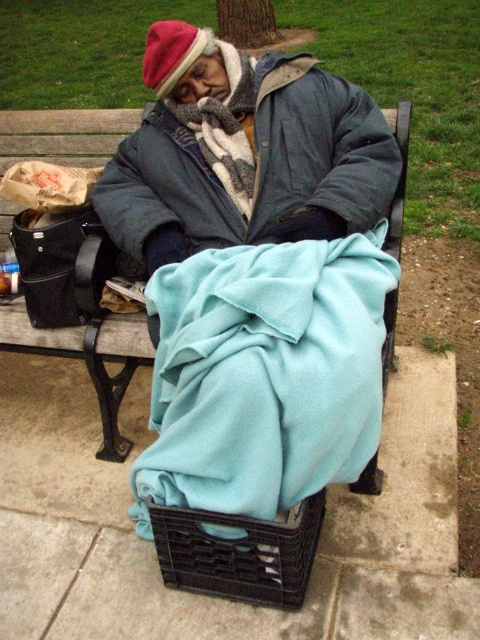
Looking at this image, who is more forward, (259, 458) or (120, 369)?

Point (259, 458)

From the picture: Which is more to the left, teal fleece blanket at lower center or wooden bench at center?

From the viewer's perspective, wooden bench at center appears more on the left side.

Is point (274, 420) closer to viewer compared to point (405, 100)?

Yes, point (274, 420) is in front of point (405, 100).

Where is `teal fleece blanket at lower center`? teal fleece blanket at lower center is located at coordinates (264, 374).

Is point (333, 396) closer to viewer compared to point (276, 195)?

Yes, point (333, 396) is closer to viewer.

Is teal fleece blanket at lower center below matte blue blanket at center?

Correct, teal fleece blanket at lower center is located below matte blue blanket at center.

What do you see at coordinates (264, 374) in the screenshot? The image size is (480, 640). I see `teal fleece blanket at lower center` at bounding box center [264, 374].

The width and height of the screenshot is (480, 640). Find the location of `teal fleece blanket at lower center`. teal fleece blanket at lower center is located at coordinates (264, 374).

Consider the image. Is matte blue blanket at center smaller than wooden bench at center?

No.

Which is more to the left, matte blue blanket at center or wooden bench at center?

wooden bench at center

Locate an element on the screen. The image size is (480, 640). matte blue blanket at center is located at coordinates (242, 152).